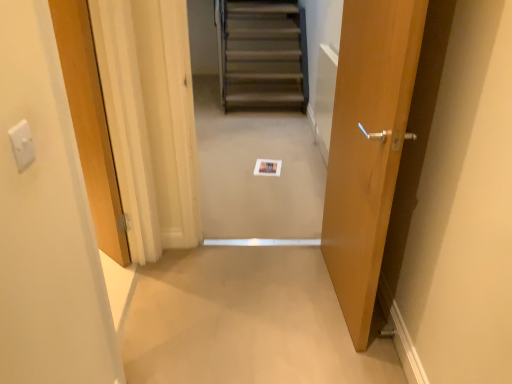
Locate an element on the screen. The width and height of the screenshot is (512, 384). free space that is to the left of matte wood door at right, which is the 2th door in left-to-right order is located at coordinates (264, 296).